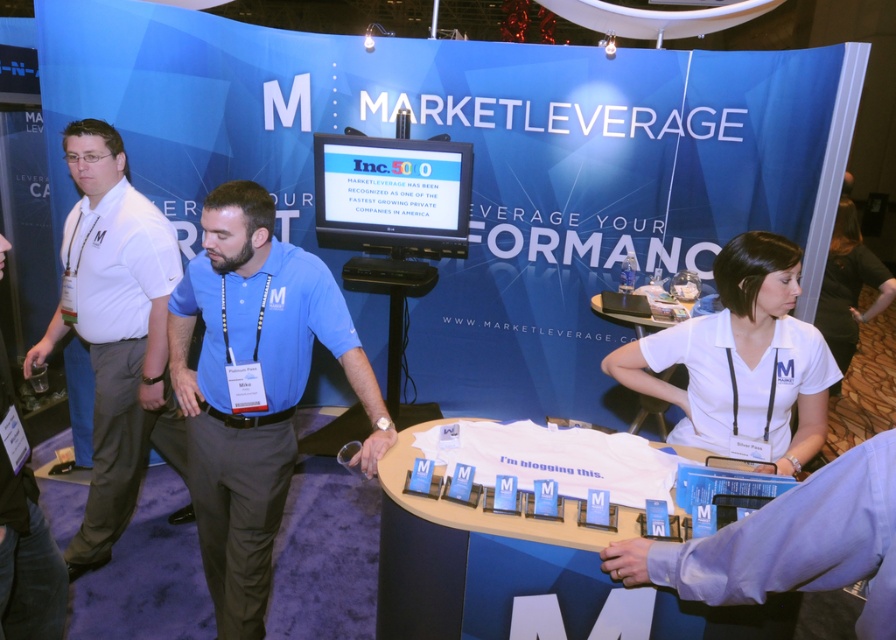
Between white cotton shirt at left and white fabric shirt at right, which one has more height?

white cotton shirt at left is taller.

Which is in front, point (73, 248) or point (876, 269)?

Point (73, 248) is more forward.

Where is `white cotton shirt at left`? The image size is (896, 640). white cotton shirt at left is located at coordinates (115, 332).

The height and width of the screenshot is (640, 896). Describe the element at coordinates (253, 388) in the screenshot. I see `blue cotton shirt at center` at that location.

Which is in front, point (205, 209) or point (842, 308)?

Point (205, 209) is more forward.

Does point (246, 416) come behind point (847, 276)?

No.

Locate an element on the screen. blue cotton shirt at center is located at coordinates (253, 388).

Is point (279, 480) less distant than point (784, 378)?

No, it is behind (784, 378).

Where is `blue cotton shirt at center`? The height and width of the screenshot is (640, 896). blue cotton shirt at center is located at coordinates (253, 388).